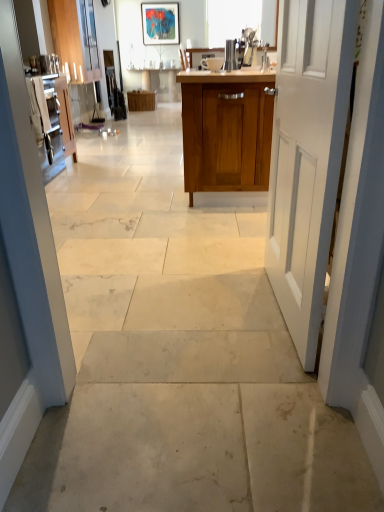
Question: Is wooden cabinet at center, arranged as the first cabinetry when viewed from the front, turned away from satin silver kettle at center?

Choices:
 (A) yes
 (B) no

Answer: (B)

Question: Is there a large distance between wooden cabinet at center, which is the 2th cabinetry in back-to-front order, and satin silver kettle at center?

Choices:
 (A) no
 (B) yes

Answer: (A)

Question: Is wooden cabinet at center, the 1th cabinetry when ordered from bottom to top, further to camera compared to satin silver kettle at center?

Choices:
 (A) no
 (B) yes

Answer: (A)

Question: Is wooden cabinet at center, the 1th cabinetry when ordered from bottom to top, thinner than satin silver kettle at center?

Choices:
 (A) yes
 (B) no

Answer: (B)

Question: Considering the relative sizes of wooden cabinet at center, arranged as the first cabinetry when viewed from the front, and satin silver kettle at center in the image provided, is wooden cabinet at center, arranged as the first cabinetry when viewed from the front, taller than satin silver kettle at center?

Choices:
 (A) no
 (B) yes

Answer: (B)

Question: Is satin silver kettle at center inside the boundaries of wooden cabinet at center, which is the second cabinetry in left-to-right order, or outside?

Choices:
 (A) outside
 (B) inside

Answer: (B)

Question: Looking at their shapes, would you say satin silver kettle at center is wider or thinner than wooden cabinet at center, arranged as the first cabinetry when viewed from the front?

Choices:
 (A) wide
 (B) thin

Answer: (B)

Question: From the image's perspective, relative to wooden cabinet at center, which is the 2th cabinetry in top-to-bottom order, is satin silver kettle at center above or below?

Choices:
 (A) above
 (B) below

Answer: (A)

Question: Based on their sizes in the image, would you say satin silver kettle at center is bigger or smaller than wooden cabinet at center, which is the 2th cabinetry in top-to-bottom order?

Choices:
 (A) small
 (B) big

Answer: (A)

Question: From a real-world perspective, is wooden cabinet at center, arranged as the first cabinetry when viewed from the front, positioned above or below white matte door at right?

Choices:
 (A) above
 (B) below

Answer: (B)

Question: Considering the positions of wooden cabinet at center, which is the second cabinetry in left-to-right order, and white matte door at right in the image, is wooden cabinet at center, which is the second cabinetry in left-to-right order, bigger or smaller than white matte door at right?

Choices:
 (A) big
 (B) small

Answer: (A)

Question: Is wooden cabinet at center, which is the 2th cabinetry in top-to-bottom order, taller or shorter than white matte door at right?

Choices:
 (A) tall
 (B) short

Answer: (B)

Question: Is point (206, 105) positioned closer to the camera than point (296, 189)?

Choices:
 (A) closer
 (B) farther

Answer: (B)

Question: From the image's perspective, is matte acrylic painting at upper center above or below matte wood cabinet at upper left, the second cabinetry when ordered from front to back?

Choices:
 (A) below
 (B) above

Answer: (B)

Question: From their relative heights in the image, would you say matte acrylic painting at upper center is taller or shorter than matte wood cabinet at upper left, which ranks as the 2th cabinetry in right-to-left order?

Choices:
 (A) tall
 (B) short

Answer: (B)